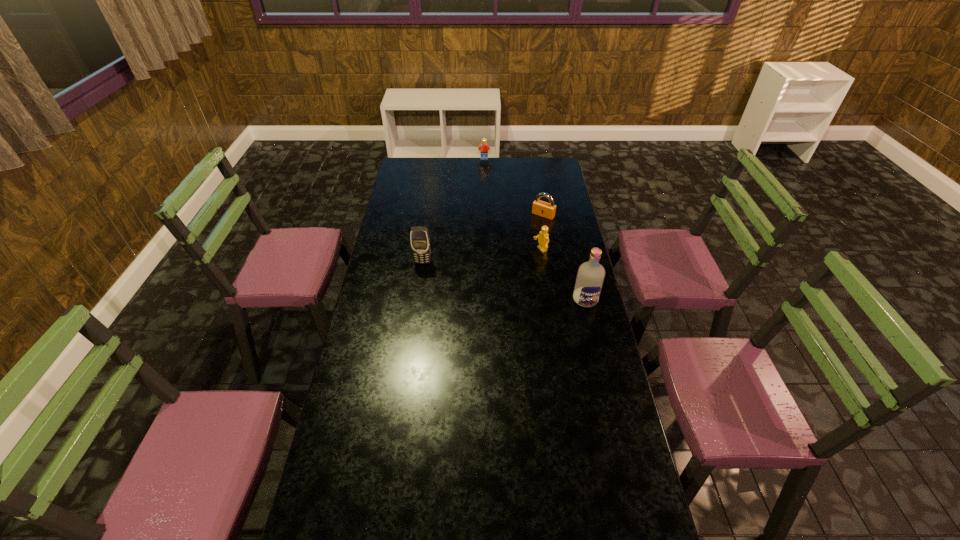
At what (x,y) coordinates should I click in order to perform the action: click on cellular telephone. Please return your answer as a coordinate pair (x, y). The height and width of the screenshot is (540, 960). Looking at the image, I should click on (419, 236).

Where is `the second nearest object`? This screenshot has height=540, width=960. the second nearest object is located at coordinates (419, 236).

I want to click on vodka, so click(591, 274).

Find the location of a particular element. Image resolution: width=960 pixels, height=540 pixels. the nearest object is located at coordinates (591, 274).

Locate an element on the screen. The image size is (960, 540). the fourth object from right to left is located at coordinates (483, 148).

At what (x,y) coordinates should I click in order to perform the action: click on the farthest object. Please return your answer as a coordinate pair (x, y). The width and height of the screenshot is (960, 540). Looking at the image, I should click on (483, 148).

Find the location of a particular element. The image size is (960, 540). padlock is located at coordinates (547, 210).

Locate an element on the screen. the right Lego is located at coordinates (543, 237).

Find the location of a particular element. the nearer Lego is located at coordinates (543, 237).

Identify the location of free spot located 0.270m on the front face of the fourth farthest object. The image size is (960, 540). (416, 312).